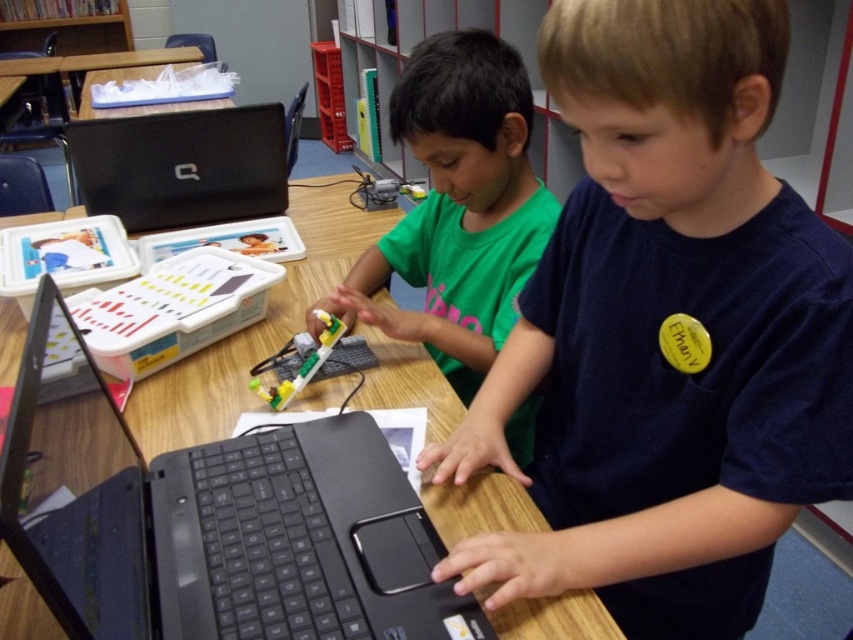
Is point (183, 481) behind point (440, 324)?

No.

Can you confirm if black matte laptop at center is positioned above green matte shirt at center?

Actually, black matte laptop at center is below green matte shirt at center.

Who is more distant from viewer, (259, 624) or (398, 248)?

The point (398, 248) is behind.

Image resolution: width=853 pixels, height=640 pixels. I want to click on black matte laptop at center, so click(x=209, y=518).

Can you confirm if dark blue shirt at center is thinner than green matte shirt at center?

No, dark blue shirt at center is not thinner than green matte shirt at center.

Can you confirm if dark blue shirt at center is positioned to the right of green matte shirt at center?

Yes, dark blue shirt at center is to the right of green matte shirt at center.

Does point (558, 97) come behind point (490, 211)?

No, (558, 97) is in front of (490, 211).

What are the coordinates of `dark blue shirt at center` in the screenshot? It's located at (657, 330).

Is dark blue shirt at center behind black matte laptop at center?

Yes.

Is dark blue shirt at center to the left of black matte laptop at center from the viewer's perspective?

In fact, dark blue shirt at center is to the right of black matte laptop at center.

Is point (788, 316) behind point (86, 573)?

Yes, point (788, 316) is farther from viewer.

Find the location of a particular element. The image size is (853, 640). dark blue shirt at center is located at coordinates (657, 330).